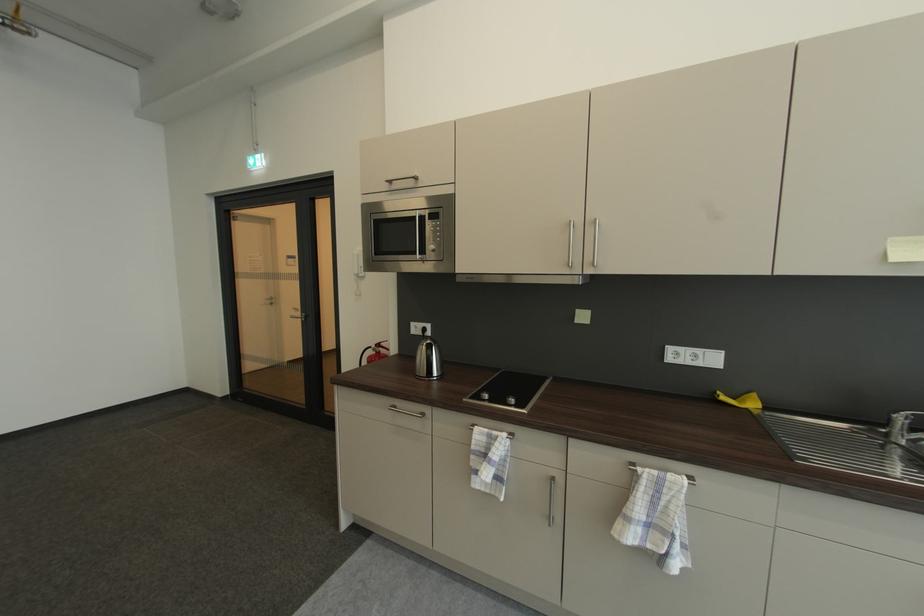
Find where to lift the white intercom handset. Please return your answer as a coordinate pair (x, y).

(359, 264)